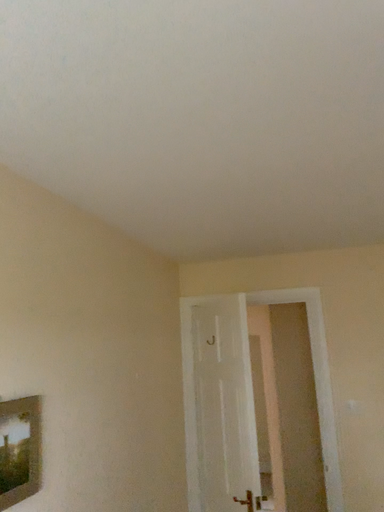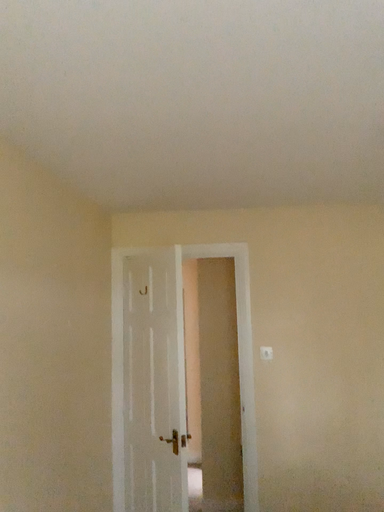
Question: How did the camera likely rotate when shooting the video?

Choices:
 (A) rotated left
 (B) rotated right

Answer: (B)